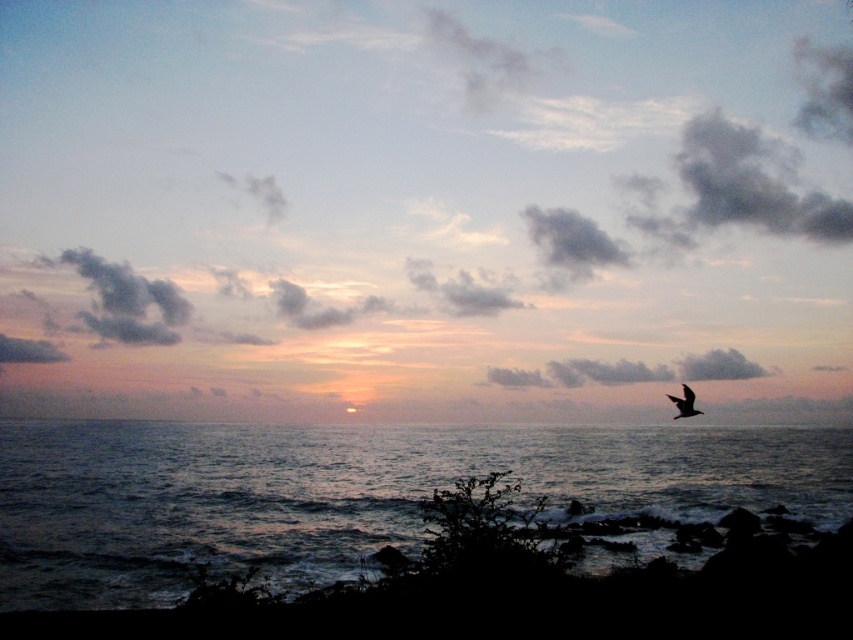
You are an artist trying to paint the sunset scene. You need to decide which object between the dark gray cloud at upper center and the dark blue water at lower center requires more horizontal space on your canvas. Which one should you allocate more width to?

The dark gray cloud at upper center requires more horizontal space because its width surpasses that of the dark blue water at lower center.

You are a photographer standing at the edge of the water in the sunset scene. You notice two points in the image, one at point coordinates point [439,193] and another at point [683,385]. If you want to capture both points in a single frame without moving, which point should you focus on first to ensure both are in focus?

You should focus on point [439,193] first because it is closer to you than point [683,385]. By focusing on the closer point, the farther point will also be within the depth of field, ensuring both are in focus.

You are an astronomer analyzing the sunset image. You need to locate the dark gray cloud at upper center. What are its coordinates?

The dark gray cloud at upper center is located at coordinates point (426, 186).